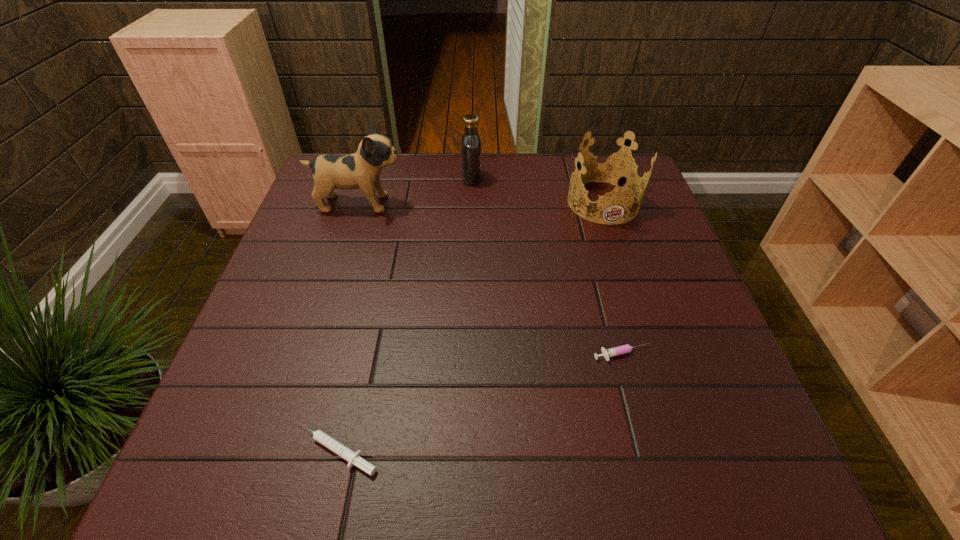
Find the location of a particular element. The height and width of the screenshot is (540, 960). vacant space situated on the left of the right syringe is located at coordinates (424, 355).

Locate an element on the screen. This screenshot has height=540, width=960. free point located 0.060m on the right of the left syringe is located at coordinates (416, 450).

This screenshot has width=960, height=540. I want to click on puppy that is at the far edge, so pyautogui.click(x=362, y=169).

This screenshot has height=540, width=960. I want to click on vodka positioned at the far edge, so click(471, 142).

At what (x,y) coordinates should I click in order to perform the action: click on crown located at the far edge. Please return your answer as a coordinate pair (x, y). The width and height of the screenshot is (960, 540). Looking at the image, I should click on (612, 167).

Identify the location of object that is at the near edge. point(353,458).

Where is `object that is at the left edge`? object that is at the left edge is located at coordinates (362, 169).

Identify the location of crown at the right edge. The width and height of the screenshot is (960, 540). (612, 167).

Find the location of a particular element. The image size is (960, 540). syringe that is at the right edge is located at coordinates (623, 349).

Where is `object present at the far left corner`? This screenshot has height=540, width=960. object present at the far left corner is located at coordinates (362, 169).